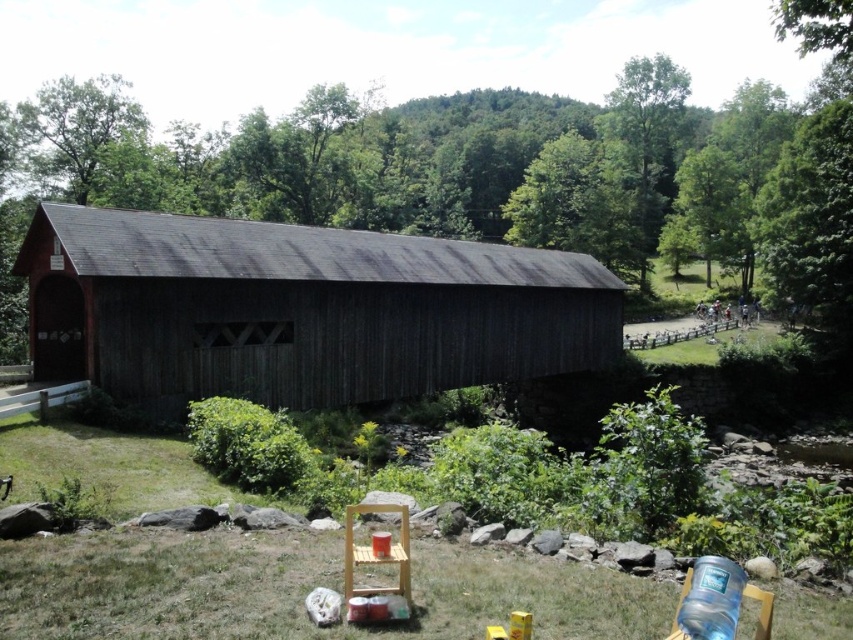
Question: Which object is farther from the camera taking this photo?

Choices:
 (A) green grass at lower center
 (B) dark brown wooden bridge at center

Answer: (B)

Question: Is dark brown wooden bridge at center closer to camera compared to green grass at lower center?

Choices:
 (A) no
 (B) yes

Answer: (A)

Question: Which point is farther from the camera taking this photo?

Choices:
 (A) (497, 380)
 (B) (163, 545)

Answer: (A)

Question: Observing the image, what is the correct spatial positioning of dark brown wooden bridge at center in reference to green grass at lower center?

Choices:
 (A) right
 (B) left

Answer: (A)

Question: Is dark brown wooden bridge at center to the right of green grass at lower center from the viewer's perspective?

Choices:
 (A) no
 (B) yes

Answer: (B)